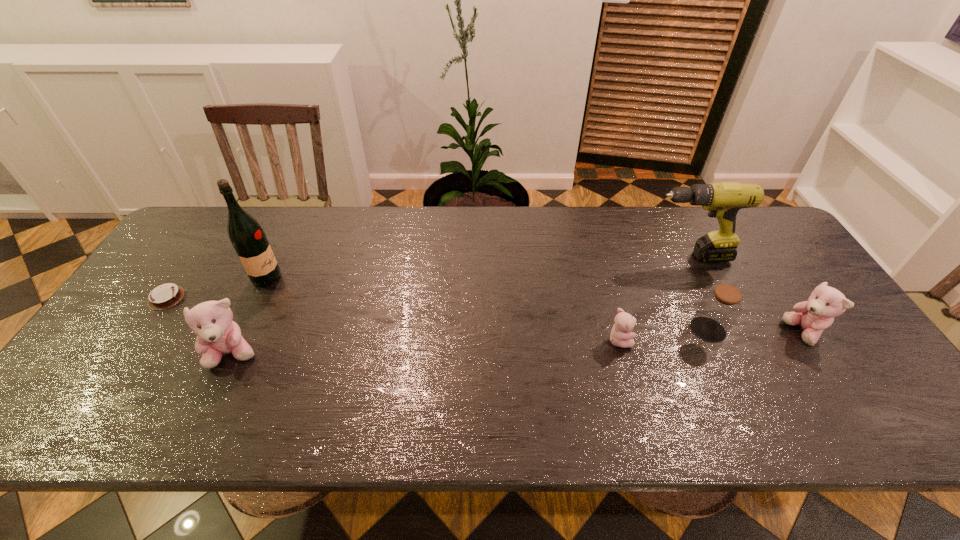
Find the location of a particular element. The height and width of the screenshot is (540, 960). free space located 0.220m on the front of the chocolate cake is located at coordinates (109, 382).

Where is `vacant space located 0.290m on the right of the jar`? The image size is (960, 540). vacant space located 0.290m on the right of the jar is located at coordinates (837, 330).

At what (x,y) coordinates should I click in order to perform the action: click on object that is at the far edge. Please return your answer as a coordinate pair (x, y). Looking at the image, I should click on (723, 200).

You are a GUI agent. You are given a task and a screenshot of the screen. Output one action in this format:
    pyautogui.click(x=<x>, y=<y>)
    Task: Click on the object at the near edge
    This screenshot has width=960, height=540.
    Given the screenshot: What is the action you would take?
    pyautogui.click(x=217, y=335)

You are a GUI agent. You are given a task and a screenshot of the screen. Output one action in this format:
    pyautogui.click(x=<x>, y=<y>)
    Task: Click on the object present at the left edge
    The height and width of the screenshot is (540, 960).
    Given the screenshot: What is the action you would take?
    pyautogui.click(x=167, y=295)

This screenshot has height=540, width=960. I want to click on object present at the right edge, so click(813, 316).

In the image, there is a desktop. Identify the location of free space at the far edge. (391, 215).

At what (x,y) coordinates should I click in order to perform the action: click on vacant space at the near edge of the desktop. Please return your answer as a coordinate pair (x, y). Looking at the image, I should click on (608, 367).

Image resolution: width=960 pixels, height=540 pixels. In order to click on free region at the left edge in this screenshot , I will do `click(208, 274)`.

Where is `vacant space at the far right corner of the desktop`? vacant space at the far right corner of the desktop is located at coordinates (756, 243).